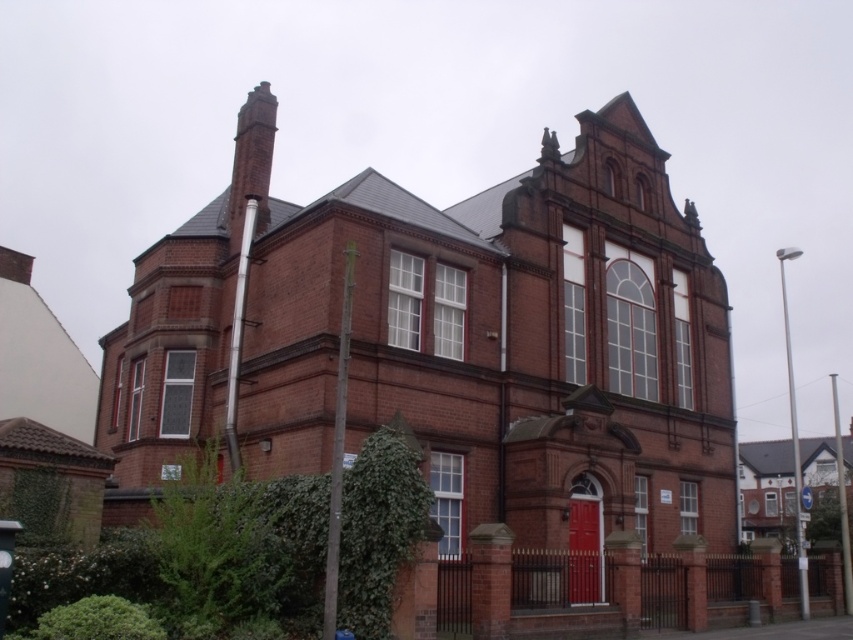
You are standing in front of the two story brick building and want to locate both the red brick church at center and the red brick chimney at upper left. Based on their positions, which one is higher up in the image?

The red brick chimney at upper left is higher up in the image because the red brick church at center is located below it.

You are an architect analyzing the building from a distance. You notice two points on the building labeled as point (x=671, y=262) and point (x=252, y=173). Which point is closer to your line of sight?

Point (x=671, y=262) is further to the viewer than point (x=252, y=173), so the point closer to your line of sight is point (x=252, y=173).

You are an architect assessing the structural integrity of the building. You need to determine if the red brick chimney at upper left is narrower than the red brick church at center. Based on the provided information, can you confirm this?

The red brick church at center might be wider than red brick chimney at upper left, so the chimney is likely narrower than the church.